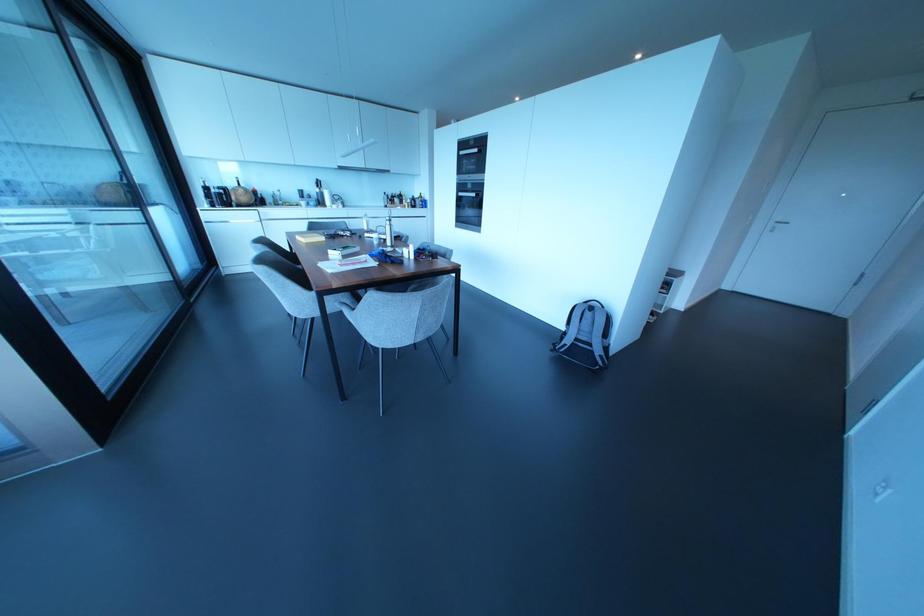
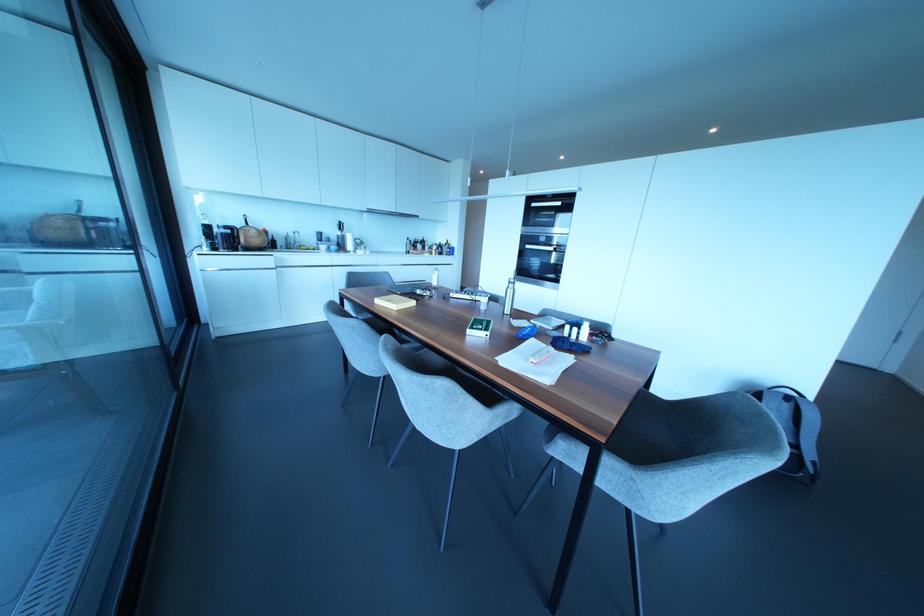
In the second image, find the point that corresponds to [341,168] in the first image.

(370, 209)